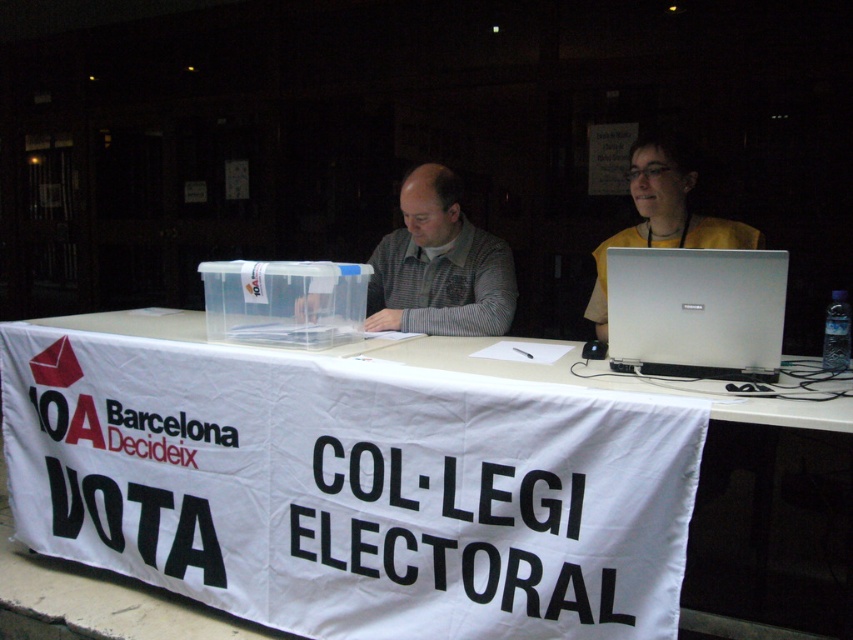
You are a voter who just arrived at the polling station. You see a silver metallic laptop at center and a white paper at center on the table. Which item is placed on top of the other?

The silver metallic laptop at center is positioned over white paper at center, so the laptop is on top of the paper.

You are a voter standing at the entrance of the polling station. You see the silver metallic laptop at center on the table. Based on its position, can you estimate where it is located relative to the table?

The silver metallic laptop at center is located at the lower part of the table since its 2D coordinates are at point (695, 310). The y coordinate 0.817 indicates it is closer to the bottom edge of the table.

From the picture: You are a voter approaching the table at the polling station. You see a silver metallic laptop at center and a gray knitted sweater at center. Which object is closer to you?

The silver metallic laptop at center is closer to you than the gray knitted sweater at center.